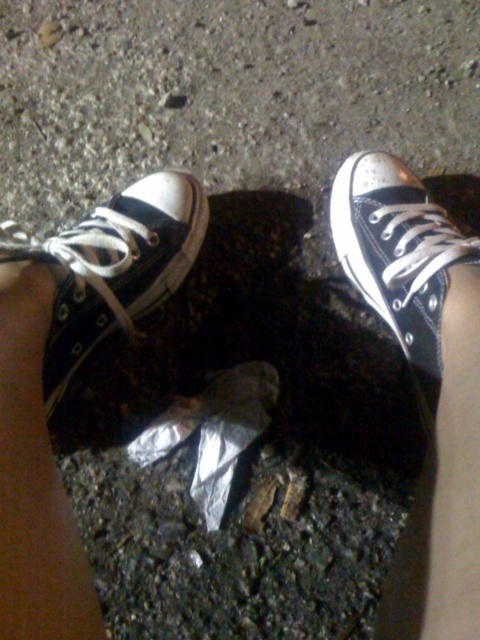
Question: Does matte canvas sneaker at lower left appear on the right side of matte black sneaker at upper right?

Choices:
 (A) no
 (B) yes

Answer: (A)

Question: Among these objects, which one is farthest from the camera?

Choices:
 (A) matte canvas sneaker at lower left
 (B) matte black sneaker at upper right

Answer: (B)

Question: Is matte canvas sneaker at lower left to the left of matte black sneaker at upper right from the viewer's perspective?

Choices:
 (A) no
 (B) yes

Answer: (B)

Question: Which of the following is the farthest from the observer?

Choices:
 (A) (403, 227)
 (B) (85, 301)

Answer: (A)

Question: Which of the following is the farthest from the observer?

Choices:
 (A) matte black sneaker at upper right
 (B) matte canvas sneaker at lower left

Answer: (A)

Question: Considering the relative positions of matte canvas sneaker at lower left and matte black sneaker at upper right in the image provided, where is matte canvas sneaker at lower left located with respect to matte black sneaker at upper right?

Choices:
 (A) left
 (B) right

Answer: (A)